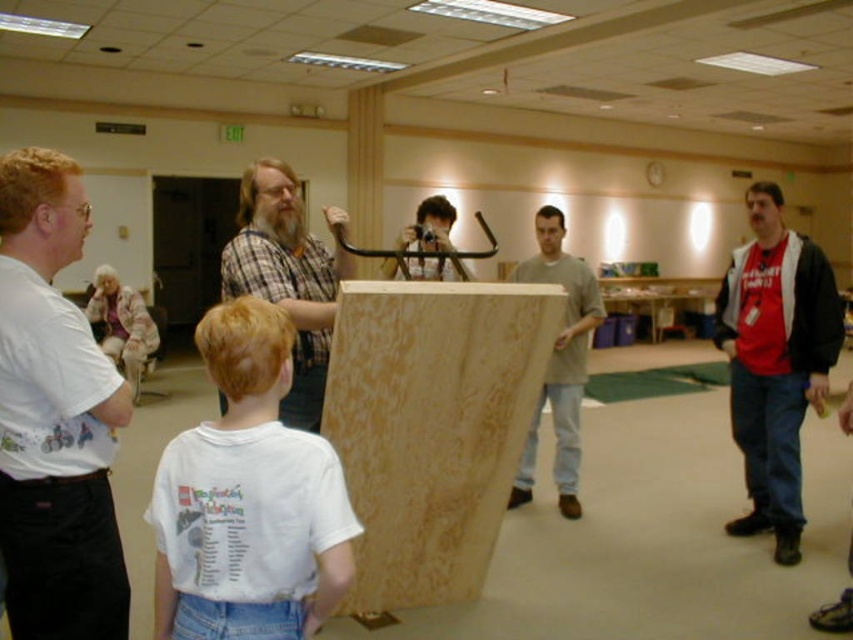
Question: Is white cotton shirt at left wider than white t-shirt at center?

Choices:
 (A) yes
 (B) no

Answer: (B)

Question: Which of the following is the farthest from the observer?

Choices:
 (A) red cotton t-shirt at right
 (B) white cotton shirt at left
 (C) white t-shirt at center
 (D) birch plywood at center

Answer: (A)

Question: Among these objects, which one is nearest to the camera?

Choices:
 (A) wooden board at center
 (B) light brown wood board at center
 (C) red cotton t-shirt at right
 (D) birch plywood at center

Answer: (A)

Question: Which of the following is the closest to the observer?

Choices:
 (A) (451, 314)
 (B) (178, 609)
 (C) (270, 218)

Answer: (B)

Question: From the image, what is the correct spatial relationship of white cotton shirt at left in relation to light brown wood board at center?

Choices:
 (A) below
 (B) above

Answer: (B)

Question: Is birch plywood at center thinner than light brown wood board at center?

Choices:
 (A) no
 (B) yes

Answer: (A)